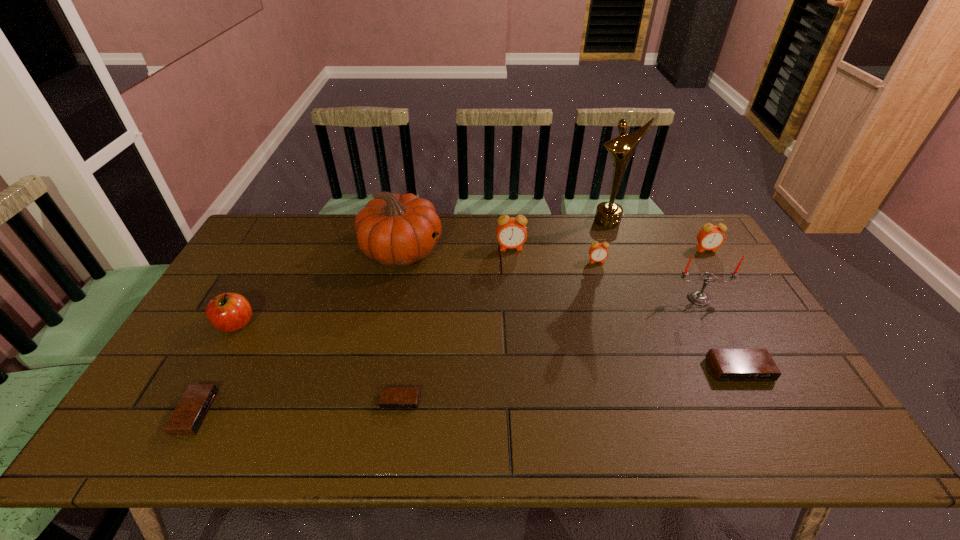
I want to click on object that stands as the fifth closest to the third nearest object, so click(x=511, y=232).

Choose which alarm clock is the nearest neighbor to the orange pumpkin. Please provide its 2D coordinates. Your answer should be formatted as a tuple, i.e. [(x, y)], where the tuple contains the x and y coordinates of a point satisfying the conditions above.

[(511, 232)]

This screenshot has height=540, width=960. I want to click on alarm clock that is the third closest to the smallest pink alarm clock, so click(728, 365).

Choose which pink alarm clock is the third nearest neighbor to the farthest black alarm clock. Please provide its 2D coordinates. Your answer should be formatted as a tuple, i.e. [(x, y)], where the tuple contains the x and y coordinates of a point satisfying the conditions above.

[(511, 232)]

Identify which pink alarm clock is the closest to the smallest pink alarm clock. Please provide its 2D coordinates. Your answer should be formatted as a tuple, i.e. [(x, y)], where the tuple contains the x and y coordinates of a point satisfying the conditions above.

[(511, 232)]

What are the coordinates of `the third closest black alarm clock to the fourth alarm clock from left to right` in the screenshot? It's located at (189, 414).

Locate which black alarm clock ranks in proximity to the third nearest alarm clock. Please provide its 2D coordinates. Your answer should be formatted as a tuple, i.e. [(x, y)], where the tuple contains the x and y coordinates of a point satisfying the conditions above.

[(391, 397)]

Find the location of a particular element. vacant space that satisfies the following two spatial constraints: 1. on the front-facing side of the red candle; 2. on the front face of the second smallest black alarm clock is located at coordinates (758, 412).

The image size is (960, 540). I want to click on free space that satisfies the following two spatial constraints: 1. on the face of the leftmost pink alarm clock; 2. on the face of the orange pumpkin, so click(512, 251).

Locate an element on the screen. This screenshot has width=960, height=540. free space that satisfies the following two spatial constraints: 1. on the front face of the shortest alarm clock; 2. on the front face of the leftmost black alarm clock is located at coordinates (398, 412).